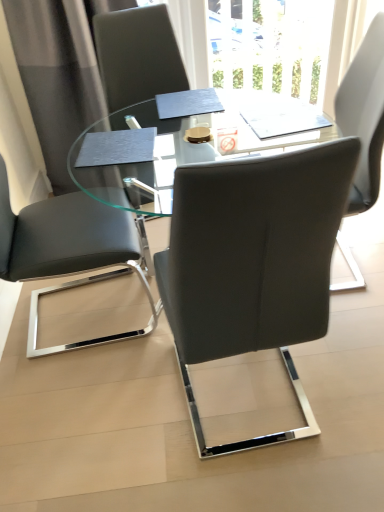
Where is `free space to the left of matte gray chair at center, which is the second chair in left-to-right order`? The image size is (384, 512). free space to the left of matte gray chair at center, which is the second chair in left-to-right order is located at coordinates (111, 423).